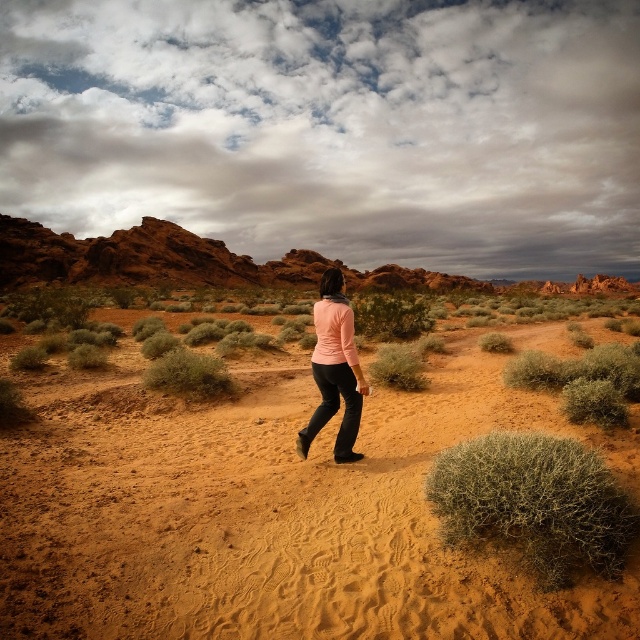
Who is positioned more to the right, brown sandy dirt at center or matte pink sweater at center?

matte pink sweater at center is more to the right.

Does brown sandy dirt at center come in front of matte pink sweater at center?

Yes, brown sandy dirt at center is in front of matte pink sweater at center.

Is point (369, 481) positioned before point (337, 305)?

Yes, it is in front of point (337, 305).

Where is `brown sandy dirt at center`? brown sandy dirt at center is located at coordinates (273, 512).